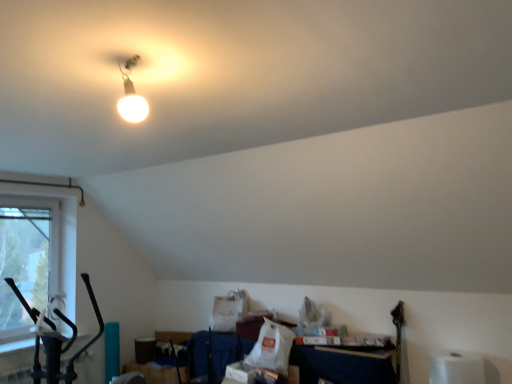
Question: Is matte white bulb at upper center wider or thinner than clear glass window at left?

Choices:
 (A) wide
 (B) thin

Answer: (A)

Question: Is matte white bulb at upper center spatially inside clear glass window at left, or outside of it?

Choices:
 (A) inside
 (B) outside

Answer: (B)

Question: Which is nearer to the white matte toilet paper at lower right?

Choices:
 (A) clear glass window at left
 (B) matte white bulb at upper center

Answer: (B)

Question: Estimate the real-world distances between objects in this image. Which object is closer to the white matte toilet paper at lower right?

Choices:
 (A) clear glass window at left
 (B) matte white bulb at upper center

Answer: (B)